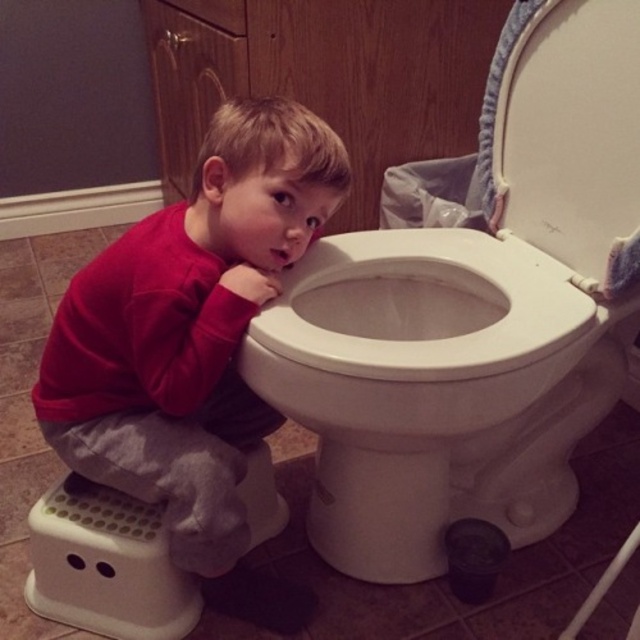
You are a parent trying to teach your child to use the bathroom. You see the white glossy toilet bowl at center and the white plastic step stool at lower left. Which object should you move to make it easier for the child to reach the toilet bowl?

The white plastic step stool at lower left should be moved closer to the white glossy toilet bowl at center so the child can step onto it and reach the toilet bowl more easily.

You are a bathroom designer planning to install a new toilet. The current toilet is located at point [433,390]. Where should you place the new toilet to maintain the same position as the existing one?

You should place the new toilet at point [433,390] to maintain the same position as the existing white glossy toilet bowl at center.

You are a parent trying to ensure your child can reach the sink to wash hands. The red fleece shirt at center and white plastic step stool at lower left are in the bathroom. Which item is taller and might block the child from reaching the sink?

The red fleece shirt at center is taller than the white plastic step stool at lower left, so it might block the child from reaching the sink.